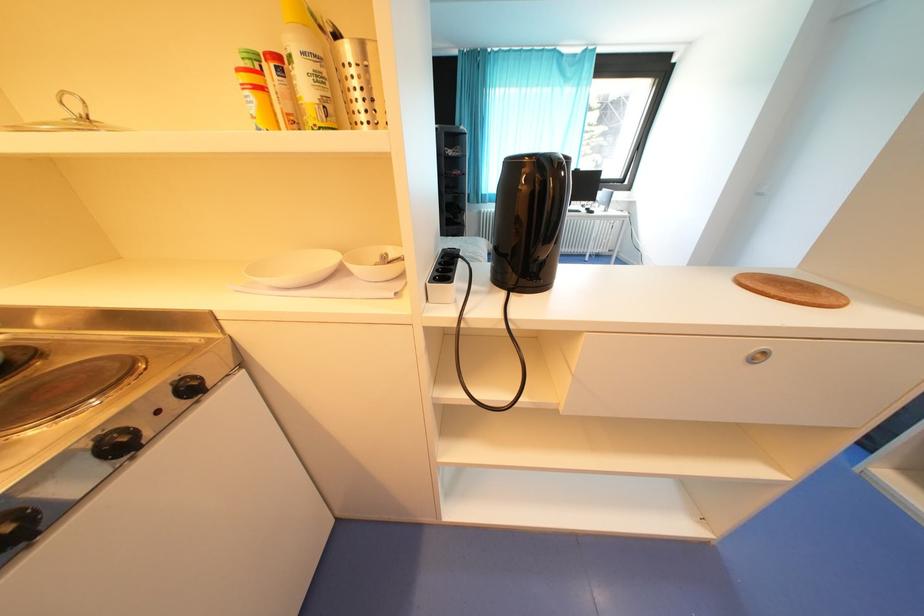
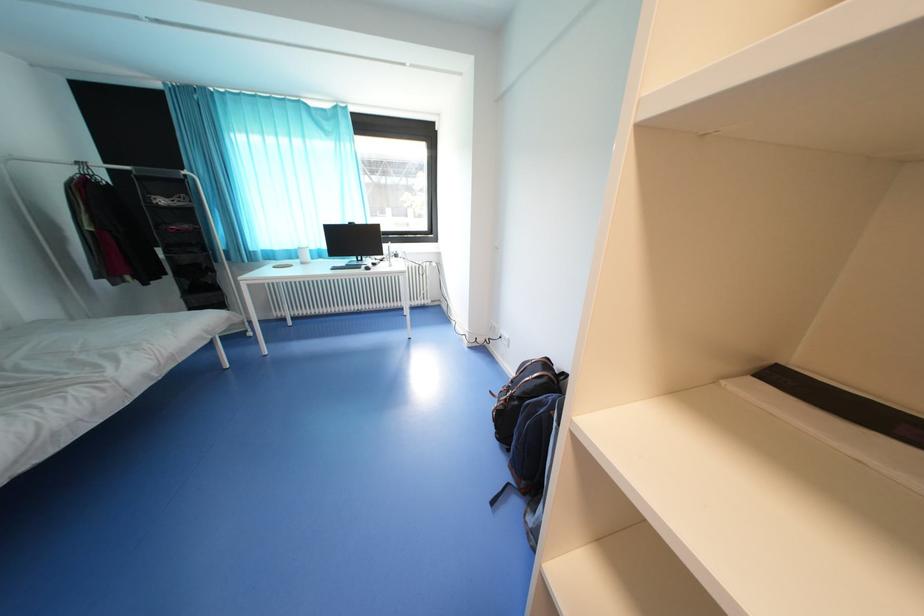
Question: The images are taken continuously from a first-person perspective. In which direction are you moving?

Choices:
 (A) Left
 (B) Right
 (C) Forward
 (D) Backward

Answer: (B)